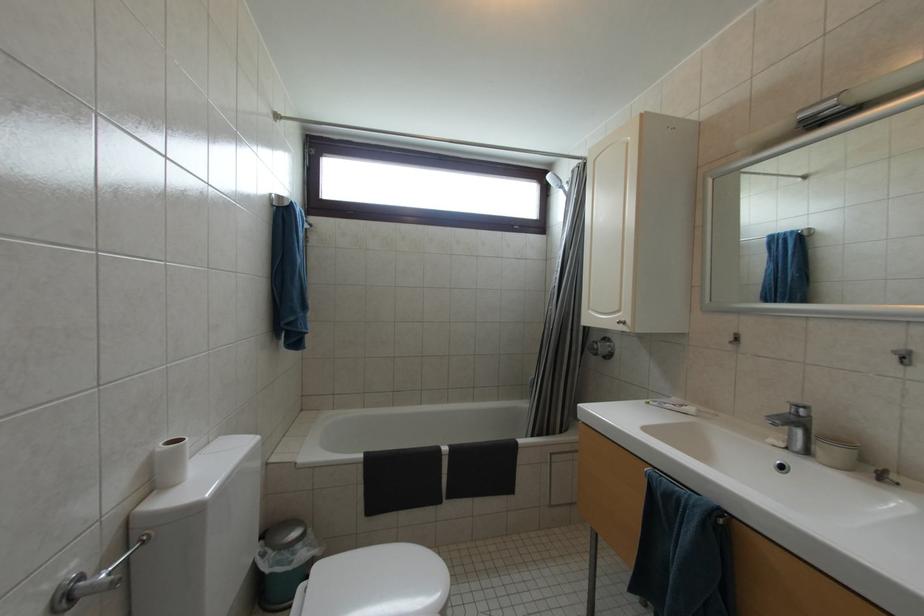
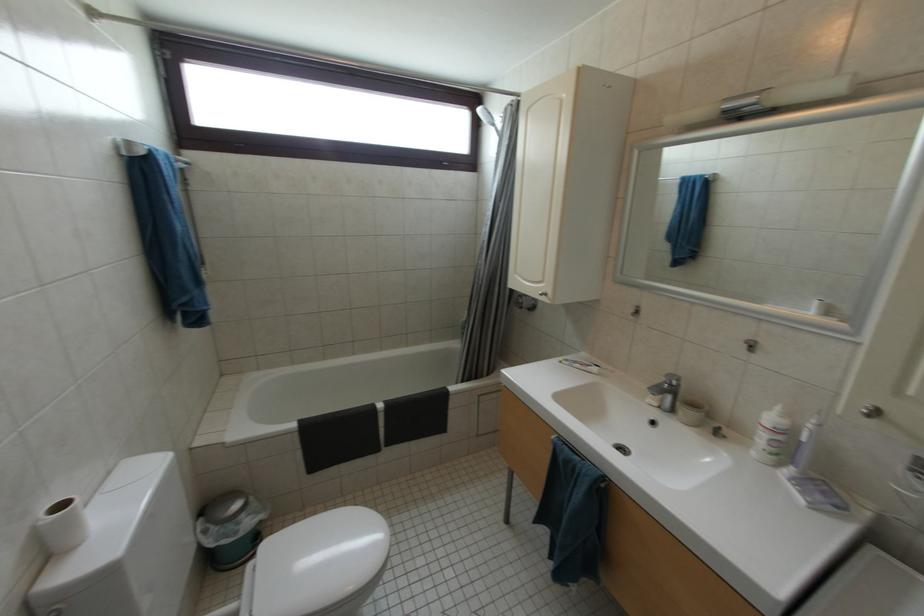
Question: The first image is from the beginning of the video and the second image is from the end. How did the camera likely rotate when shooting the video?

Choices:
 (A) Left
 (B) Right
 (C) Up
 (D) Down

Answer: (D)